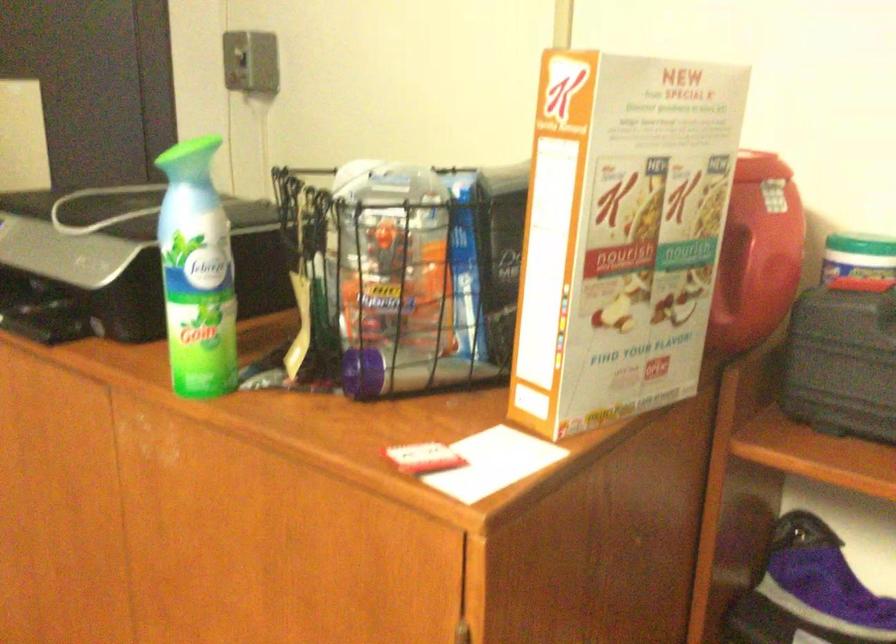
Where would you lift the cardboard cereal box? Please return your answer as a coordinate pair (x, y).

(640, 228)